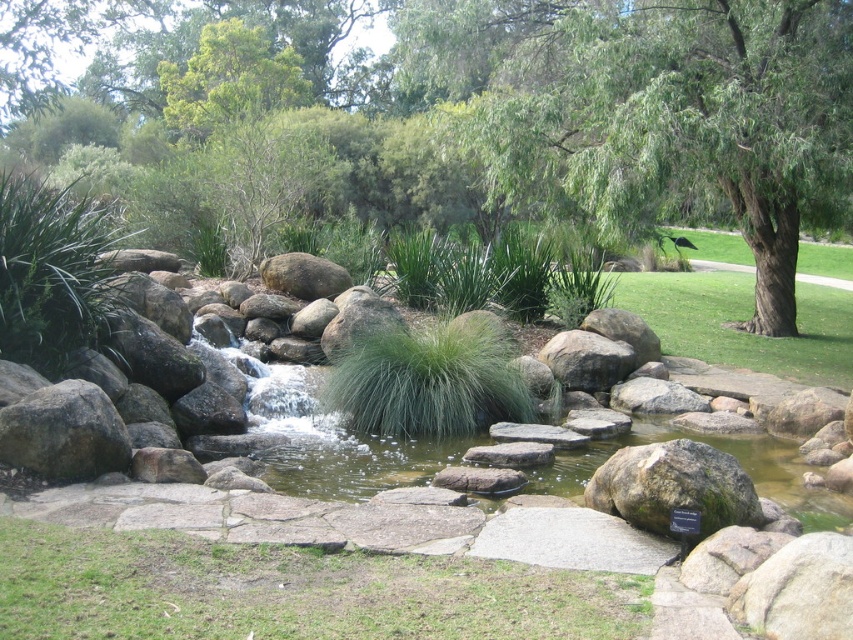
You are a gardener who wants to plant a new flower between the green grass at lower center and the green fuzzy grass at center. Based on their positions, where should you place the flower so it is between them?

You should place the flower between the green grass at lower center and the green fuzzy grass at center by positioning it above the green grass at lower center and below the green fuzzy grass at center since the green grass at lower center is located below the green fuzzy grass at center.

You are a gardener planning to place a new decorative plant pot between the gray rough rock at left and the rustic brown rock at center. The pot requires a minimum of 30 cm of space to fit. Based on the scene, can you determine if there is enough space between these two rocks?

The gray rough rock at left has a lesser width compared to rustic brown rock at center. However, the exact distance between them isn not specified in the provided information. Therefore, it is uncertain whether the 30 cm space requirement can be met.

You are standing at the edge of the stream and want to walk to the green leafy tree at center. Which direction should you head relative to the green leafy tree at upper center?

You should head to the right of the green leafy tree at upper center because the green leafy tree at center is located to its right side.